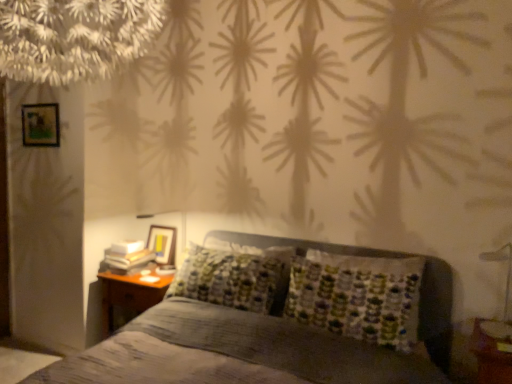
This screenshot has width=512, height=384. I want to click on wooden glossy picture frame at upper left, arranged as the 1th picture frame when ordered from the bottom, so click(162, 244).

In order to face wooden picture frame at upper left, which ranks as the 2th picture frame in right-to-left order, should I rotate leftwards or rightwards?

You should rotate left by 26.890 degrees.

Where is `wooden glossy picture frame at upper left, the first picture frame positioned from the right`? The height and width of the screenshot is (384, 512). wooden glossy picture frame at upper left, the first picture frame positioned from the right is located at coordinates (162, 244).

Does point (488, 257) come closer to viewer compared to point (246, 313)?

That is True.

Between metallic silver bedside lamp at lower right and textured gray bed at center, which one has smaller width?

metallic silver bedside lamp at lower right.

Which object is closer to the camera, metallic silver bedside lamp at lower right or textured gray bed at center?

textured gray bed at center is closer to the camera.

From the picture: Is textured gray bed at center completely or partially outside of wooden picture frame at upper left, the second picture frame in the bottom-to-top sequence?

Yes, textured gray bed at center is outside of wooden picture frame at upper left, the second picture frame in the bottom-to-top sequence.

Between textured gray bed at center and wooden picture frame at upper left, which ranks as the 2th picture frame in right-to-left order, which one has smaller size?

wooden picture frame at upper left, which ranks as the 2th picture frame in right-to-left order.

Considering the sizes of objects textured gray bed at center and wooden picture frame at upper left, the 2th picture frame when ordered from back to front, in the image provided, who is wider, textured gray bed at center or wooden picture frame at upper left, the 2th picture frame when ordered from back to front,?

With larger width is textured gray bed at center.

From the image's perspective, between textured gray bed at center and wooden picture frame at upper left, the first picture frame from the front, who is located below?

textured gray bed at center is shown below in the image.

Would you say metallic silver bedside lamp at lower right is to the left or to the right of woodennightstand at lower left in the picture?

metallic silver bedside lamp at lower right is to the right of woodennightstand at lower left.

From a real-world perspective, is metallic silver bedside lamp at lower right under woodennightstand at lower left?

No.

Is metallic silver bedside lamp at lower right looking in the opposite direction of woodennightstand at lower left?

No, metallic silver bedside lamp at lower right is not facing the opposite direction of woodennightstand at lower left.

Is wooden glossy picture frame at upper left, acting as the 2th picture frame starting from the top, next to woodennightstand at lower left?

No, wooden glossy picture frame at upper left, acting as the 2th picture frame starting from the top, is not making contact with woodennightstand at lower left.

Is wooden glossy picture frame at upper left, acting as the 2th picture frame starting from the top, aimed at woodennightstand at lower left?

No, wooden glossy picture frame at upper left, acting as the 2th picture frame starting from the top, is not aimed at woodennightstand at lower left.

From the image's perspective, which is above, wooden glossy picture frame at upper left, the second picture frame positioned from the left, or woodennightstand at lower left?

wooden glossy picture frame at upper left, the second picture frame positioned from the left, appears higher in the image.

Considering the relative sizes of wooden glossy picture frame at upper left, the second picture frame positioned from the left, and woodennightstand at lower left in the image provided, is wooden glossy picture frame at upper left, the second picture frame positioned from the left, wider than woodennightstand at lower left?

No, wooden glossy picture frame at upper left, the second picture frame positioned from the left, is not wider than woodennightstand at lower left.

Considering the positions of objects wooden glossy picture frame at upper left, the second picture frame positioned from the left, and wooden picture frame at upper left, the first picture frame from the front, in the image provided, who is behind, wooden glossy picture frame at upper left, the second picture frame positioned from the left, or wooden picture frame at upper left, the first picture frame from the front,?

wooden glossy picture frame at upper left, the second picture frame positioned from the left, is behind.

Considering the points (166, 255) and (32, 109), which point is behind, point (166, 255) or point (32, 109)?

The point (166, 255) is more distant.

Based on the photo, is wooden glossy picture frame at upper left, which is the 1th picture frame in back-to-front order, at the right side of wooden picture frame at upper left, which ranks as the 2th picture frame in right-to-left order?

Correct, you'll find wooden glossy picture frame at upper left, which is the 1th picture frame in back-to-front order, to the right of wooden picture frame at upper left, which ranks as the 2th picture frame in right-to-left order.

Is wooden picture frame at upper left, the second picture frame in the bottom-to-top sequence, completely or partially inside wooden glossy picture frame at upper left, acting as the 2th picture frame starting from the top?

No, wooden glossy picture frame at upper left, acting as the 2th picture frame starting from the top, does not contain wooden picture frame at upper left, the second picture frame in the bottom-to-top sequence.

From the image's perspective, does woodennightstand at lower left appear lower than textured gray bed at center?

Actually, woodennightstand at lower left appears above textured gray bed at center in the image.

Which object is positioned more to the right, woodennightstand at lower left or textured gray bed at center?

textured gray bed at center is more to the right.

Could you tell me if woodennightstand at lower left is facing textured gray bed at center?

Yes, woodennightstand at lower left is facing textured gray bed at center.

Image resolution: width=512 pixels, height=384 pixels. I want to click on nightstand located underneath the textured gray bed at center (from a real-world perspective), so click(129, 294).

Is woodennightstand at lower left positioned with its back to wooden glossy picture frame at upper left, which is the 1th picture frame in back-to-front order?

No, wooden glossy picture frame at upper left, which is the 1th picture frame in back-to-front order, is not at the back of woodennightstand at lower left.

Based on the photo, what's the angular difference between woodennightstand at lower left and wooden glossy picture frame at upper left, which is the 1th picture frame in back-to-front order,'s facing directions?

woodennightstand at lower left and wooden glossy picture frame at upper left, which is the 1th picture frame in back-to-front order, are facing 0.000461 degrees away from each other.

Considering the sizes of woodennightstand at lower left and wooden glossy picture frame at upper left, which is the 1th picture frame in back-to-front order, in the image, is woodennightstand at lower left taller or shorter than wooden glossy picture frame at upper left, which is the 1th picture frame in back-to-front order,?

In the image, woodennightstand at lower left appears to be taller than wooden glossy picture frame at upper left, which is the 1th picture frame in back-to-front order.

In terms of size, does woodennightstand at lower left appear bigger or smaller than wooden glossy picture frame at upper left, which is the 1th picture frame in back-to-front order?

woodennightstand at lower left is bigger than wooden glossy picture frame at upper left, which is the 1th picture frame in back-to-front order.

You are a GUI agent. You are given a task and a screenshot of the screen. Output one action in this format:
    pyautogui.click(x=<x>, y=<y>)
    Task: Click on the bedside lamp behind the textured gray bed at center
    The width and height of the screenshot is (512, 384).
    Given the screenshot: What is the action you would take?
    pyautogui.click(x=507, y=269)

The width and height of the screenshot is (512, 384). What are the coordinates of `bed that is under the wooden picture frame at upper left, the second picture frame in the bottom-to-top sequence (from a real-world perspective)` in the screenshot? It's located at (313, 339).

Considering their positions, is woodennightstand at lower left positioned further to wooden glossy picture frame at upper left, the first picture frame positioned from the right, than textured gray bed at center?

Among the two, textured gray bed at center is located further to wooden glossy picture frame at upper left, the first picture frame positioned from the right.

From the image, which object appears to be farther from metallic silver bedside lamp at lower right, wooden glossy picture frame at upper left, arranged as the 1th picture frame when ordered from the bottom, or textured gray bed at center?

The object further to metallic silver bedside lamp at lower right is wooden glossy picture frame at upper left, arranged as the 1th picture frame when ordered from the bottom.

Considering their positions, is metallic silver bedside lamp at lower right positioned further to woodennightstand at lower left than textured gray bed at center?

Based on the image, metallic silver bedside lamp at lower right appears to be further to woodennightstand at lower left.

Based on their spatial positions, is wooden picture frame at upper left, the second picture frame in the bottom-to-top sequence, or woodennightstand at lower left further from metallic silver bedside lamp at lower right?

wooden picture frame at upper left, the second picture frame in the bottom-to-top sequence, is positioned further to the anchor metallic silver bedside lamp at lower right.

Based on their spatial positions, is metallic silver bedside lamp at lower right or textured gray bed at center further from wooden glossy picture frame at upper left, acting as the 2th picture frame starting from the top?

metallic silver bedside lamp at lower right.

Looking at the image, which one is located closer to wooden picture frame at upper left, which ranks as the 2th picture frame in right-to-left order, woodennightstand at lower left or wooden glossy picture frame at upper left, the second picture frame positioned from the left?

wooden glossy picture frame at upper left, the second picture frame positioned from the left, is positioned closer to the anchor wooden picture frame at upper left, which ranks as the 2th picture frame in right-to-left order.

From the image, which object appears to be farther from textured gray bed at center, wooden glossy picture frame at upper left, the 2th picture frame viewed from the front, or woodennightstand at lower left?

The object further to textured gray bed at center is wooden glossy picture frame at upper left, the 2th picture frame viewed from the front.

From the image, which object appears to be farther from wooden glossy picture frame at upper left, arranged as the 1th picture frame when ordered from the bottom, metallic silver bedside lamp at lower right or woodennightstand at lower left?

metallic silver bedside lamp at lower right.

Where is `nightstand between wooden picture frame at upper left, the first picture frame from the front, and metallic silver bedside lamp at lower right`? Image resolution: width=512 pixels, height=384 pixels. nightstand between wooden picture frame at upper left, the first picture frame from the front, and metallic silver bedside lamp at lower right is located at coordinates (129, 294).

I want to click on nightstand located between textured gray bed at center and wooden glossy picture frame at upper left, the second picture frame positioned from the left, in the depth direction, so click(129, 294).

The height and width of the screenshot is (384, 512). I want to click on picture frame located between woodennightstand at lower left and metallic silver bedside lamp at lower right in the left-right direction, so click(x=162, y=244).

The height and width of the screenshot is (384, 512). Find the location of `bedside lamp positioned between textured gray bed at center and wooden glossy picture frame at upper left, the 2th picture frame viewed from the front, from near to far`. bedside lamp positioned between textured gray bed at center and wooden glossy picture frame at upper left, the 2th picture frame viewed from the front, from near to far is located at coordinates (507, 269).